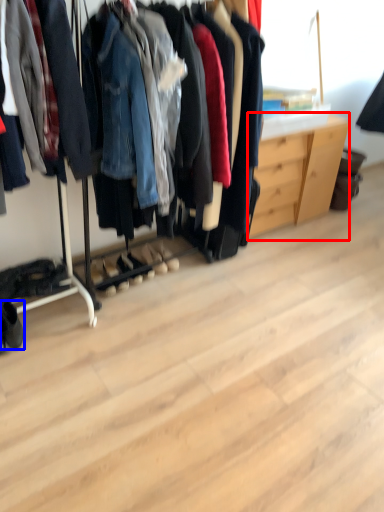
Question: Among these objects, which one is farthest to the camera, dresser (highlighted by a red box) or footwear (highlighted by a blue box)?

Choices:
 (A) dresser
 (B) footwear

Answer: (A)